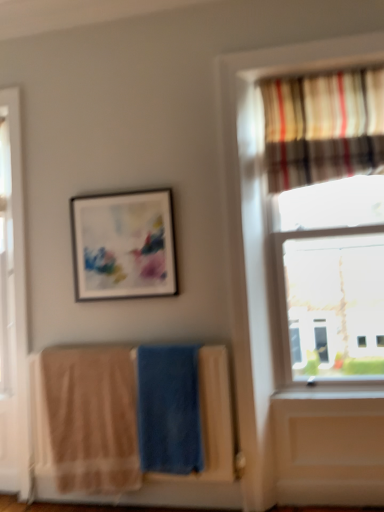
Question: Is beige cotton beach towel at lower left, which is the second beach towel from right to left, to the left of matte black picture frame at upper center from the viewer's perspective?

Choices:
 (A) no
 (B) yes

Answer: (B)

Question: From the image's perspective, would you say beige cotton beach towel at lower left, which is the second beach towel from right to left, is positioned over matte black picture frame at upper center?

Choices:
 (A) yes
 (B) no

Answer: (B)

Question: Is matte black picture frame at upper center at the back of beige cotton beach towel at lower left, which is the second beach towel from right to left?

Choices:
 (A) no
 (B) yes

Answer: (A)

Question: Is beige cotton beach towel at lower left, acting as the 1th beach towel starting from the left, further to the viewer compared to matte black picture frame at upper center?

Choices:
 (A) no
 (B) yes

Answer: (A)

Question: Is beige cotton beach towel at lower left, acting as the 1th beach towel starting from the left, positioned before matte black picture frame at upper center?

Choices:
 (A) no
 (B) yes

Answer: (B)

Question: From a real-world perspective, is matte black picture frame at upper center physically located above or below striped fabric curtain at upper right?

Choices:
 (A) below
 (B) above

Answer: (A)

Question: Is point (76, 245) closer or farther from the camera than point (354, 163)?

Choices:
 (A) farther
 (B) closer

Answer: (A)

Question: From the image's perspective, relative to striped fabric curtain at upper right, is matte black picture frame at upper center above or below?

Choices:
 (A) below
 (B) above

Answer: (A)

Question: Relative to striped fabric curtain at upper right, is matte black picture frame at upper center in front or behind?

Choices:
 (A) behind
 (B) front

Answer: (A)

Question: Would you say beige cotton beach towel at lower left, which is the second beach towel from right to left, is inside or outside striped fabric curtain at upper right?

Choices:
 (A) outside
 (B) inside

Answer: (A)

Question: Is beige cotton beach towel at lower left, acting as the 1th beach towel starting from the left, in front of or behind striped fabric curtain at upper right in the image?

Choices:
 (A) front
 (B) behind

Answer: (B)

Question: Is point (127, 396) positioned closer to the camera than point (276, 94)?

Choices:
 (A) closer
 (B) farther

Answer: (A)

Question: In terms of size, does beige cotton beach towel at lower left, acting as the 1th beach towel starting from the left, appear bigger or smaller than striped fabric curtain at upper right?

Choices:
 (A) small
 (B) big

Answer: (A)

Question: Considering the relative positions of blue soft towel at center, acting as the first beach towel starting from the right, and beige cotton towels at lower left in the image provided, is blue soft towel at center, acting as the first beach towel starting from the right, to the left or to the right of beige cotton towels at lower left?

Choices:
 (A) left
 (B) right

Answer: (B)

Question: Is point (195, 387) closer or farther from the camera than point (41, 413)?

Choices:
 (A) farther
 (B) closer

Answer: (B)